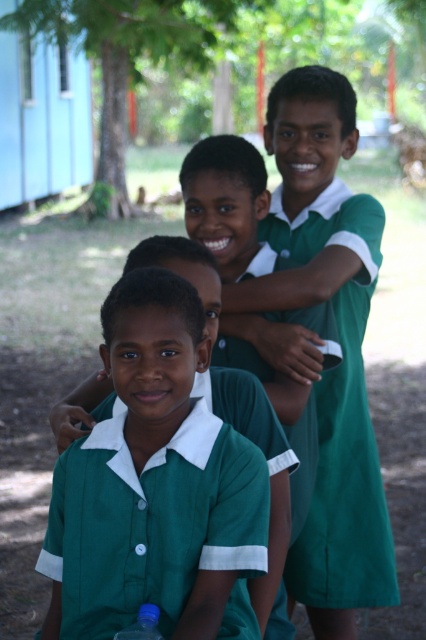
Which of these two, green uniform shirt at center or blue plastic bottle at lower left, stands shorter?

blue plastic bottle at lower left

Is point (227, 566) positioned after point (149, 618)?

Yes.

The height and width of the screenshot is (640, 426). Find the location of `green uniform shirt at center`. green uniform shirt at center is located at coordinates (155, 486).

Is point (170, 369) in front of point (313, 257)?

That is True.

Is green uniform shirt at center further to the viewer compared to green matte uniform at center?

No, green uniform shirt at center is closer to the viewer.

Does point (238, 506) lie behind point (293, 552)?

No.

Find the location of a particular element. This screenshot has width=426, height=640. green uniform shirt at center is located at coordinates (155, 486).

Does green matte uniform at center have a greater width compared to blue plastic bottle at lower left?

Yes.

Is point (287, 205) more distant than point (157, 616)?

Yes.

Describe the element at coordinates (317, 349) in the screenshot. I see `green matte uniform at center` at that location.

Find the location of a particular element. The width and height of the screenshot is (426, 640). green matte uniform at center is located at coordinates (317, 349).